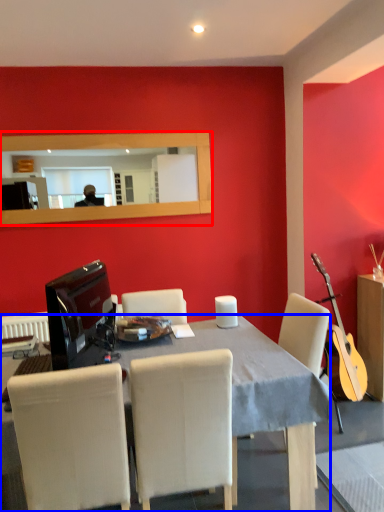
Question: Which object is closer to the camera taking this photo, mirror (highlighted by a red box) or desk (highlighted by a blue box)?

Choices:
 (A) mirror
 (B) desk

Answer: (B)